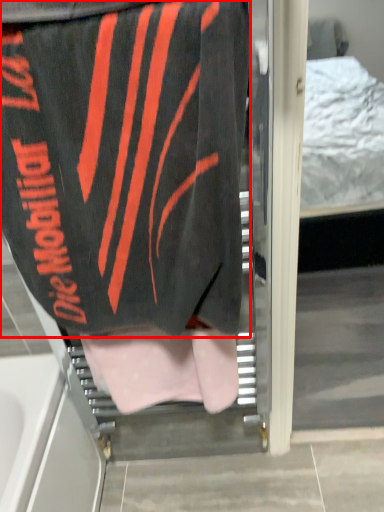
Question: From the image's perspective, what is the correct spatial positioning of towel (annotated by the red box) in reference to underclothes?

Choices:
 (A) above
 (B) below

Answer: (A)